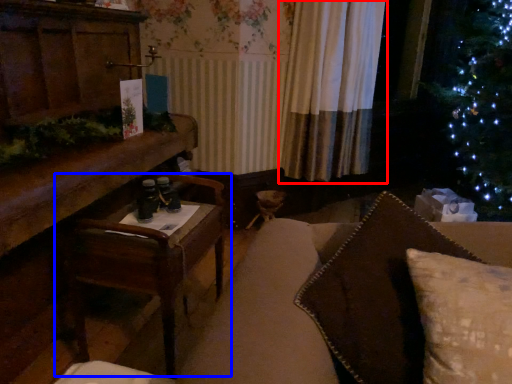
Question: Which object is closer to the camera taking this photo, curtain (highlighted by a red box) or table (highlighted by a blue box)?

Choices:
 (A) curtain
 (B) table

Answer: (B)